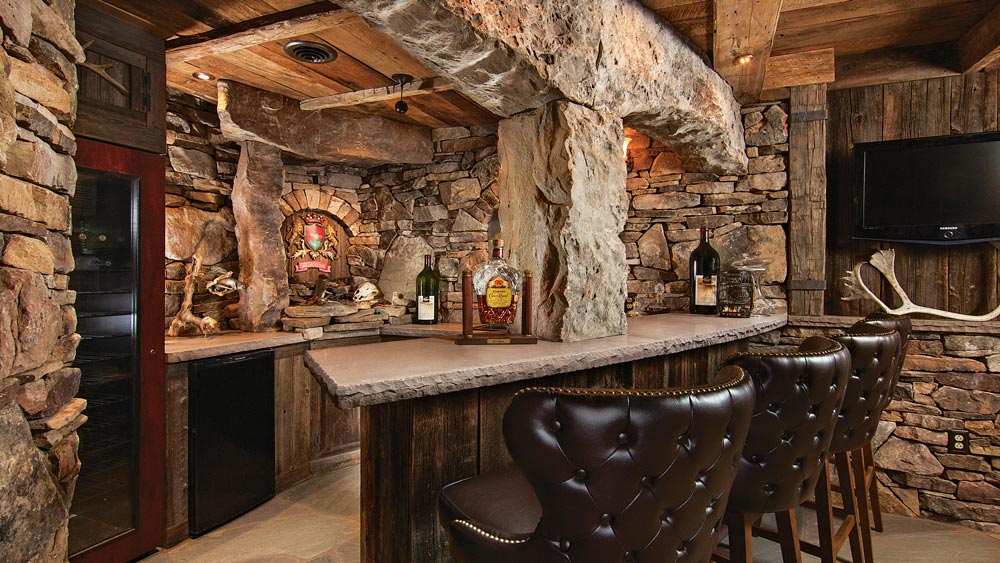
This screenshot has width=1000, height=563. Identify the location of bar. (455, 400).